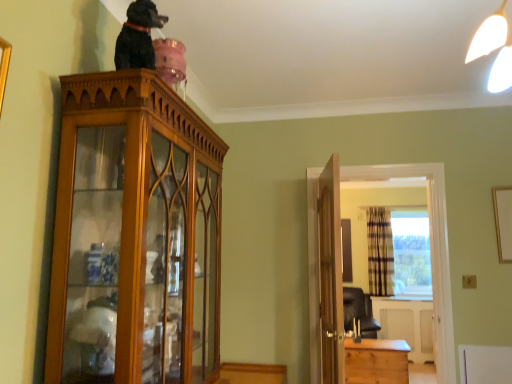
Question: Would you consider plaid fabric curtain at right to be distant from wooden cabinet at right?

Choices:
 (A) yes
 (B) no

Answer: (A)

Question: Considering the relative positions of plaid fabric curtain at right and wooden cabinet at right in the image provided, is plaid fabric curtain at right to the left of wooden cabinet at right from the viewer's perspective?

Choices:
 (A) yes
 (B) no

Answer: (B)

Question: Is plaid fabric curtain at right behind wooden cabinet at right?

Choices:
 (A) yes
 (B) no

Answer: (A)

Question: Considering the relative sizes of plaid fabric curtain at right and wooden cabinet at right in the image provided, is plaid fabric curtain at right thinner than wooden cabinet at right?

Choices:
 (A) yes
 (B) no

Answer: (A)

Question: Is plaid fabric curtain at right completely or partially outside of wooden cabinet at right?

Choices:
 (A) no
 (B) yes

Answer: (B)

Question: Is plaid fabric curtain at right at the right side of wooden cabinet at right?

Choices:
 (A) no
 (B) yes

Answer: (B)

Question: Does black glossy statue at upper center come in front of wooden door at center?

Choices:
 (A) no
 (B) yes

Answer: (B)

Question: Can you confirm if black glossy statue at upper center is positioned to the left of wooden door at center?

Choices:
 (A) yes
 (B) no

Answer: (A)

Question: Is the position of black glossy statue at upper center more distant than that of wooden door at center?

Choices:
 (A) no
 (B) yes

Answer: (A)

Question: Can you confirm if black glossy statue at upper center is smaller than wooden door at center?

Choices:
 (A) yes
 (B) no

Answer: (A)

Question: Is black glossy statue at upper center at the right side of wooden door at center?

Choices:
 (A) yes
 (B) no

Answer: (B)

Question: From a real-world perspective, is black glossy statue at upper center on top of wooden door at center?

Choices:
 (A) yes
 (B) no

Answer: (A)

Question: Is light brown wooden chest at lower right completely or partially outside of wooden door at center?

Choices:
 (A) no
 (B) yes

Answer: (B)